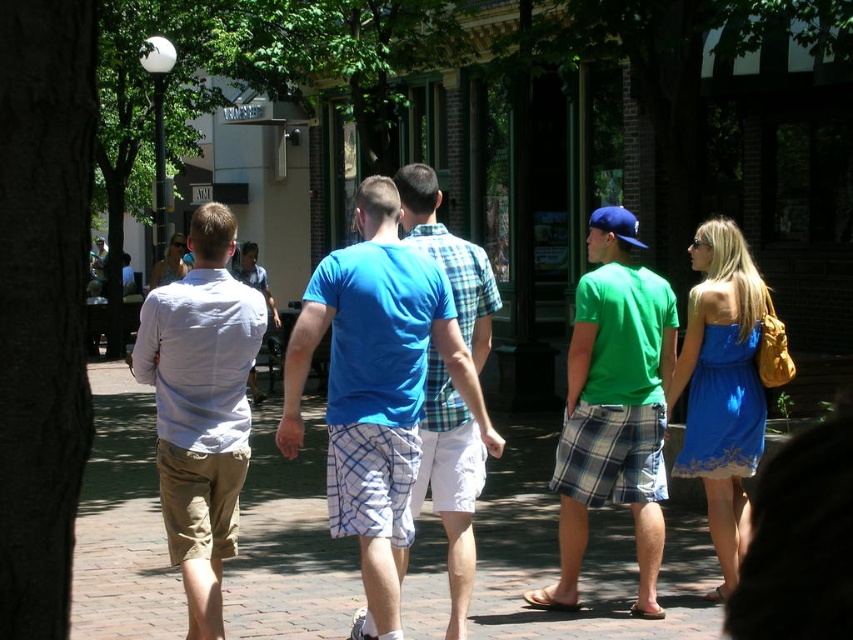
Who is more distant from viewer, (x=386, y=516) or (x=235, y=291)?

The point (x=235, y=291) is behind.

Locate an element on the screen. blue cotton t-shirt at center is located at coordinates (376, 388).

Can you confirm if blue cotton t-shirt at center is positioned below green plaid shorts at center?

No, blue cotton t-shirt at center is not below green plaid shorts at center.

Image resolution: width=853 pixels, height=640 pixels. What do you see at coordinates (376, 388) in the screenshot?
I see `blue cotton t-shirt at center` at bounding box center [376, 388].

The image size is (853, 640). I want to click on blue cotton t-shirt at center, so click(x=376, y=388).

Does brown brick pavement at center come behind green plaid shorts at center?

No.

Who is lower down, brown brick pavement at center or green plaid shorts at center?

brown brick pavement at center is below.

Which is in front, point (276, 604) or point (671, 328)?

Point (671, 328)

You are a GUI agent. You are given a task and a screenshot of the screen. Output one action in this format:
    pyautogui.click(x=<x>, y=<y>)
    Task: Click on the brown brick pavement at center
    Image resolution: width=853 pixels, height=640 pixels.
    Given the screenshot: What is the action you would take?
    pyautogui.click(x=584, y=561)